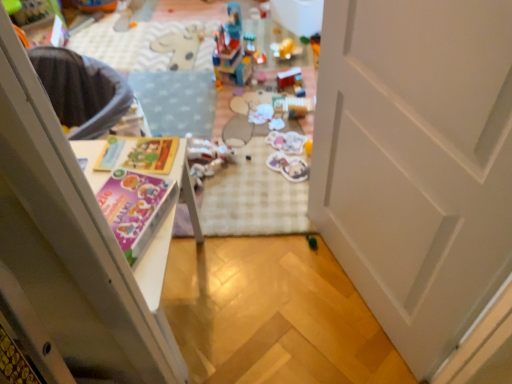
The width and height of the screenshot is (512, 384). I want to click on free space in front of translucent plastic toy at center, placed as the third toy when sorted from bottom to top, so click(x=216, y=197).